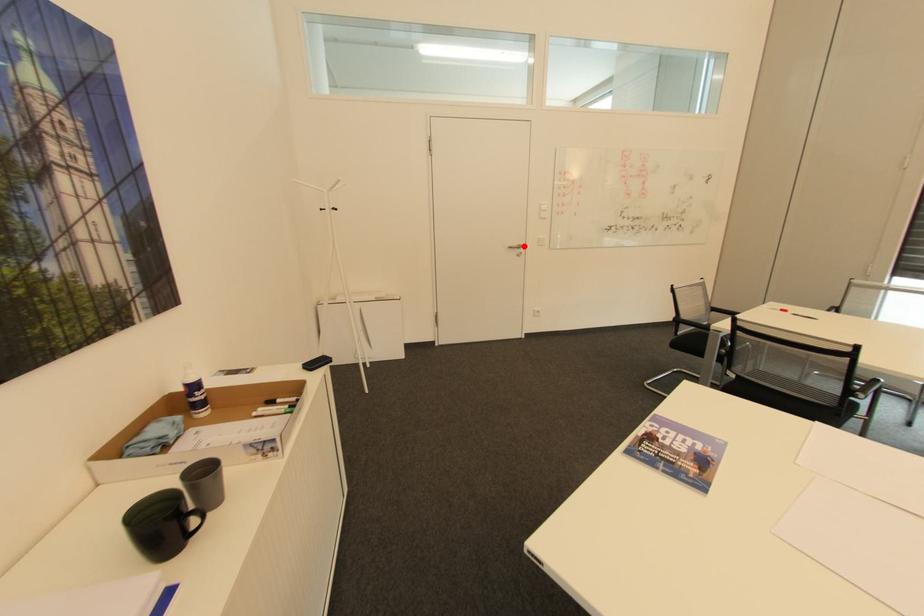
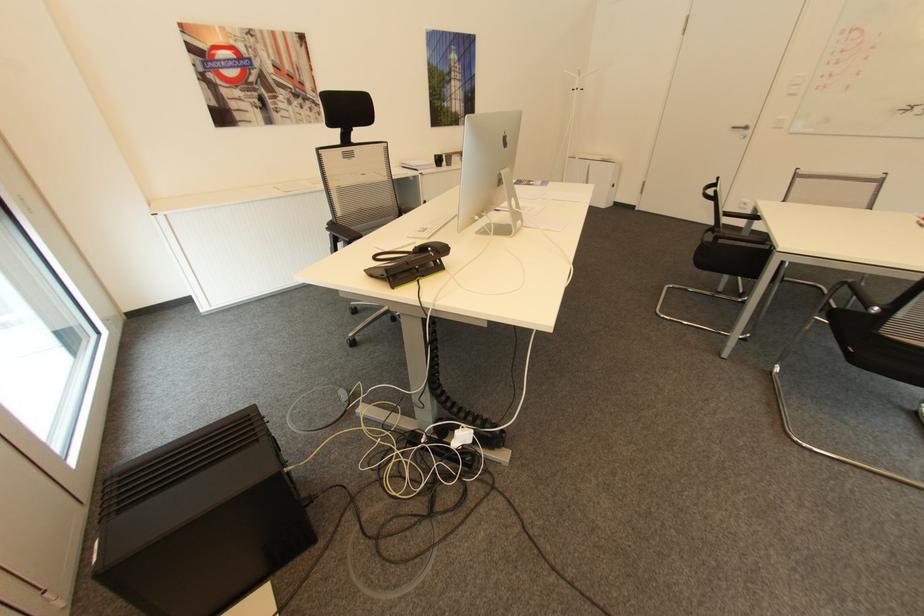
Where in the second image is the point corresponding to the highlighted location from the first image?

(749, 128)